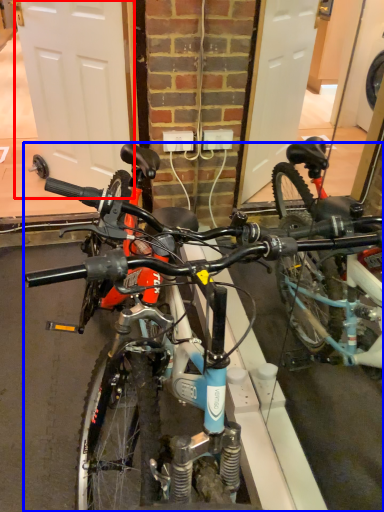
Question: Which of the following is the closest to the observer, garage door (highlighted by a red box) or bicycle (highlighted by a blue box)?

Choices:
 (A) garage door
 (B) bicycle

Answer: (B)